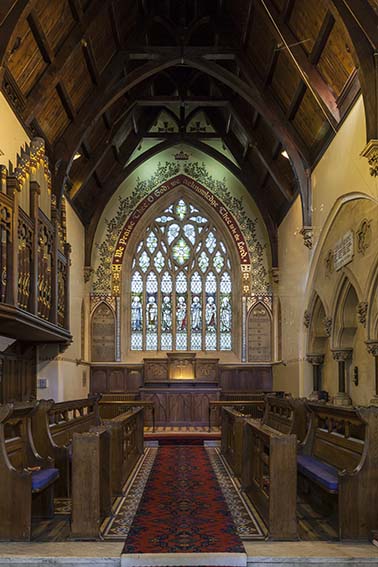
Find the location of a particular element. The image size is (378, 567). wooden railing is located at coordinates (220, 403), (121, 403), (122, 393), (236, 393).